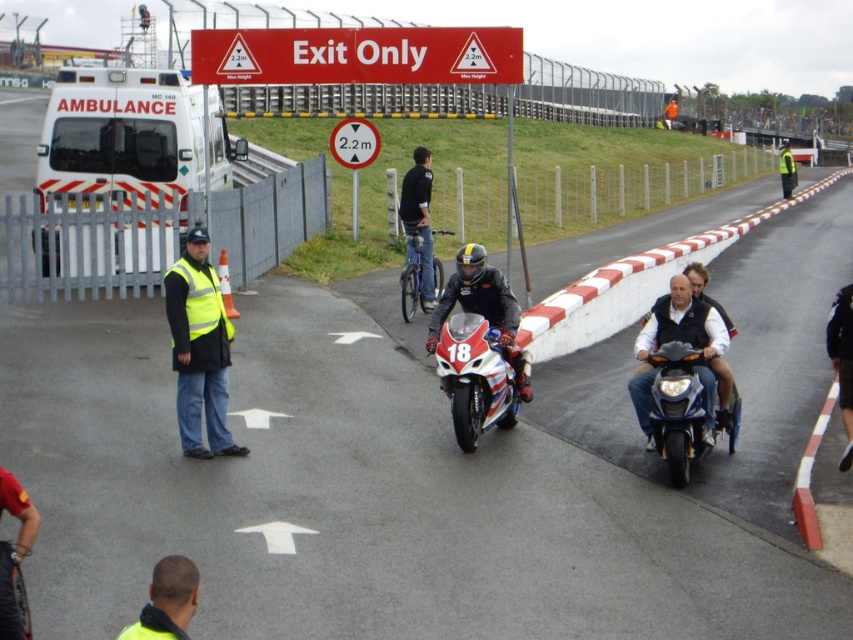
You are a spectator at the motorsport event and want to locate the safety equipment. Where exactly is the yellow reflective vest at lower center positioned in the image?

The yellow reflective vest at lower center is positioned at coordinates point (167, 602) in the image.

You are a spectator at the motorsport event. You notice the white matte ambulance at left and the yellow reflective vest at center. Which object is taller?

The white matte ambulance at left is taller than the yellow reflective vest at center.